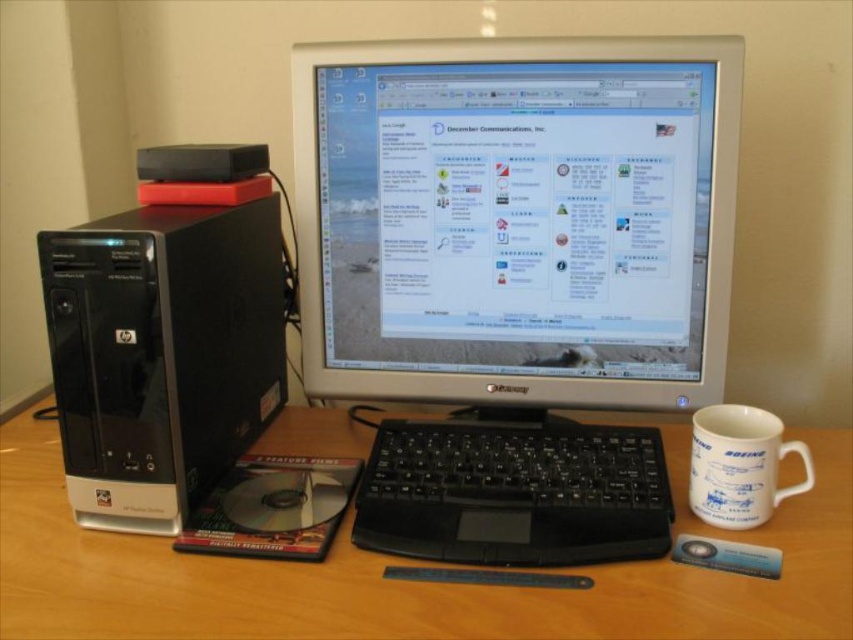
Is silver plastic monitor at center wider than white ceramic mug at right?

Correct, the width of silver plastic monitor at center exceeds that of white ceramic mug at right.

Is silver plastic monitor at center positioned before white ceramic mug at right?

That is False.

You are a GUI agent. You are given a task and a screenshot of the screen. Output one action in this format:
    pyautogui.click(x=<x>, y=<y>)
    Task: Click on the silver plastic monitor at center
    
    Given the screenshot: What is the action you would take?
    pyautogui.click(x=517, y=220)

Which of these two, black plastic keyboard at center or white ceramic mug at right, stands shorter?

Standing shorter between the two is black plastic keyboard at center.

Does point (604, 492) come farther from viewer compared to point (772, 484)?

That is True.

Does point (392, 529) come farther from viewer compared to point (770, 456)?

That is True.

I want to click on black plastic keyboard at center, so click(x=514, y=492).

Which is more to the right, silver plastic monitor at center or black plastic keyboard at center?

Positioned to the right is black plastic keyboard at center.

Between silver plastic monitor at center and black plastic keyboard at center, which one has less height?

Standing shorter between the two is black plastic keyboard at center.

Does point (315, 291) come farther from viewer compared to point (500, 513)?

Yes.

Where is `silver plastic monitor at center`? This screenshot has width=853, height=640. silver plastic monitor at center is located at coordinates (517, 220).